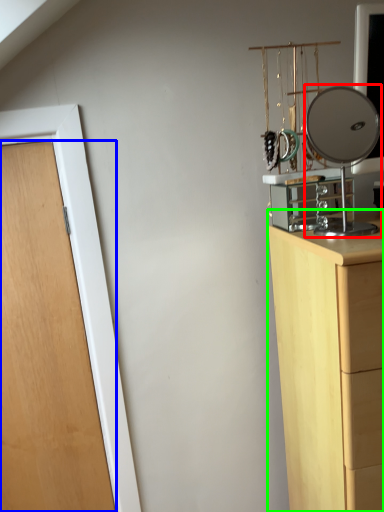
Question: Estimate the real-world distances between objects in this image. Which object is farther from mirror (highlighted by a red box), door (highlighted by a blue box) or chest of drawers (highlighted by a green box)?

Choices:
 (A) door
 (B) chest of drawers

Answer: (A)